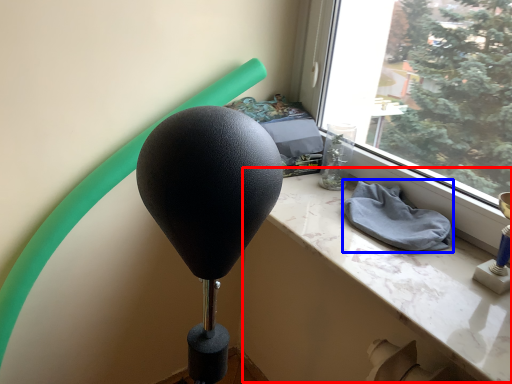
Question: Among these objects, which one is nearest to the camera, table (highlighted by a red box) or cloth (highlighted by a blue box)?

Choices:
 (A) table
 (B) cloth

Answer: (A)